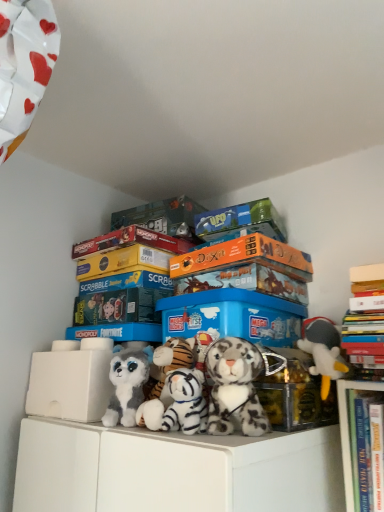
Question: Is white plush tiger at center, positioned as the second toy in left-to-right order, bigger than blue plastic storage box at center, the 3th storage box from the right?

Choices:
 (A) yes
 (B) no

Answer: (B)

Question: Does white plush tiger at center, which is counted as the 3th toy, starting from the right, have a lesser width compared to blue plastic storage box at center, the second storage box positioned from the left?

Choices:
 (A) yes
 (B) no

Answer: (A)

Question: Are white plush tiger at center, which is counted as the 3th toy, starting from the right, and blue plastic storage box at center, the second storage box positioned from the left, located far from each other?

Choices:
 (A) no
 (B) yes

Answer: (A)

Question: Does white plush tiger at center, which is counted as the 3th toy, starting from the right, come behind blue plastic storage box at center, the second storage box positioned from the left?

Choices:
 (A) no
 (B) yes

Answer: (A)

Question: Is white plush tiger at center, which is counted as the 3th toy, starting from the right, completely or partially outside of blue plastic storage box at center, the 3th storage box from the right?

Choices:
 (A) yes
 (B) no

Answer: (A)

Question: From their relative heights in the image, would you say hardcover books at upper right is taller or shorter than gray plush toy at right, which is the 1th toy from right to left?

Choices:
 (A) tall
 (B) short

Answer: (A)

Question: Is hardcover books at upper right in front of or behind gray plush toy at right, the fourth toy positioned from the left, in the image?

Choices:
 (A) front
 (B) behind

Answer: (A)

Question: From the image's perspective, is hardcover books at upper right above or below gray plush toy at right, the fourth toy positioned from the left?

Choices:
 (A) below
 (B) above

Answer: (A)

Question: Based on their positions, is hardcover books at upper right located to the left or right of gray plush toy at right, which is the 1th toy from right to left?

Choices:
 (A) left
 (B) right

Answer: (B)

Question: Is hardcover books at upper right, placed as the 1th book when sorted from right to left, inside or outside of matt orange board game at upper center, the 1th book when ordered from left to right?

Choices:
 (A) inside
 (B) outside

Answer: (B)

Question: Considering the positions of hardcover books at upper right, placed as the 1th book when sorted from right to left, and matt orange board game at upper center, which is the third book in right-to-left order, in the image, is hardcover books at upper right, placed as the 1th book when sorted from right to left, taller or shorter than matt orange board game at upper center, which is the third book in right-to-left order,?

Choices:
 (A) short
 (B) tall

Answer: (B)

Question: In the image, is hardcover books at upper right, placed as the 1th book when sorted from right to left, on the left side or the right side of matt orange board game at upper center, the 1th book when ordered from left to right?

Choices:
 (A) left
 (B) right

Answer: (B)

Question: From the image's perspective, is hardcover books at upper right, placed as the 1th book when sorted from right to left, located above or below matt orange board game at upper center, which is the third book in right-to-left order?

Choices:
 (A) below
 (B) above

Answer: (A)

Question: Is gray plush toy at right, the fourth toy positioned from the left, in front of or behind white plastic storage box at lower left, positioned as the 1th storage box in left-to-right order, in the image?

Choices:
 (A) front
 (B) behind

Answer: (A)

Question: Looking at the image, does gray plush toy at right, the fourth toy positioned from the left, seem bigger or smaller compared to white plastic storage box at lower left, placed as the fourth storage box when sorted from right to left?

Choices:
 (A) big
 (B) small

Answer: (B)